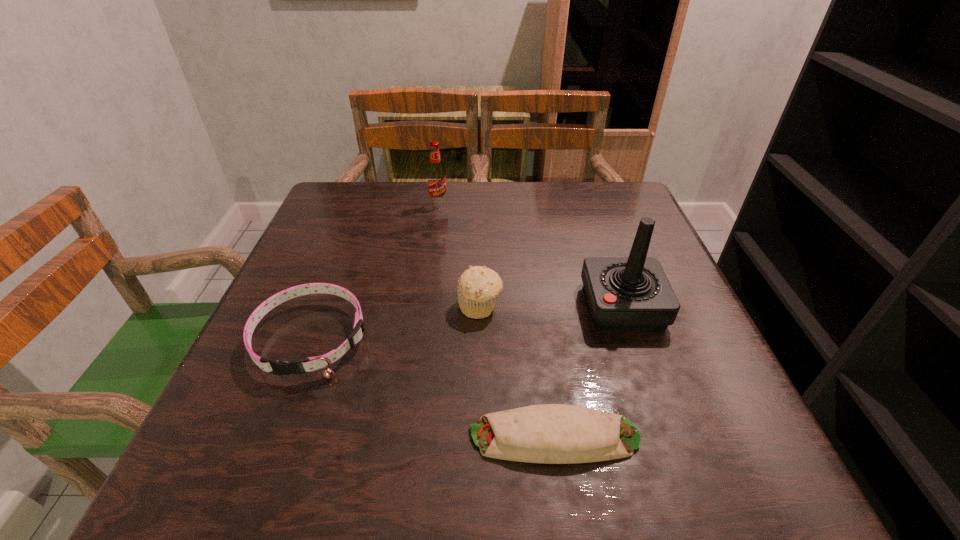
At what (x,y) coordinates should I click in order to perform the action: click on vacant space located on the front-facing side of the joystick. Please return your answer as a coordinate pair (x, y). This screenshot has width=960, height=540. Looking at the image, I should click on (431, 306).

Find the location of a particular element. Image resolution: width=960 pixels, height=540 pixels. free space located 0.350m on the front of the fourth object from right to left is located at coordinates pyautogui.click(x=425, y=301).

Where is `vacant region located on the left of the muffin`? The height and width of the screenshot is (540, 960). vacant region located on the left of the muffin is located at coordinates (348, 306).

The width and height of the screenshot is (960, 540). What are the coordinates of `blank space located with the buckle on the leftmost object` in the screenshot? It's located at (269, 450).

The height and width of the screenshot is (540, 960). I want to click on free space located at the bitten end of the shortest object, so click(x=417, y=437).

This screenshot has width=960, height=540. What are the coordinates of `free space located 0.140m at the bitten end of the shortest object` in the screenshot? It's located at (378, 437).

You are a GUI agent. You are given a task and a screenshot of the screen. Output one action in this format:
    pyautogui.click(x=<x>, y=<y>)
    Task: Click on the vacant space located 0.380m at the bitten end of the shortest object
    The width and height of the screenshot is (960, 540).
    Given the screenshot: What is the action you would take?
    pyautogui.click(x=221, y=437)

Find the location of a particular element. This screenshot has height=540, width=960. object present at the far edge is located at coordinates (436, 176).

Find the location of a particular element. This screenshot has height=540, width=960. object at the near edge is located at coordinates (548, 433).

Find the location of a particular element. object located at the left edge is located at coordinates 278,367.